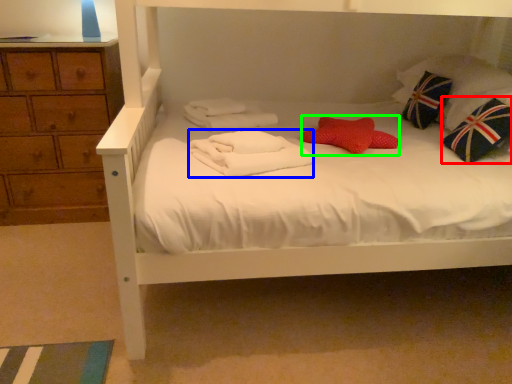
Question: Estimate the real-world distances between objects in this image. Which object is closer to throw pillow (highlighted by a red box), bath towel (highlighted by a blue box) or pillow (highlighted by a green box)?

Choices:
 (A) bath towel
 (B) pillow

Answer: (B)